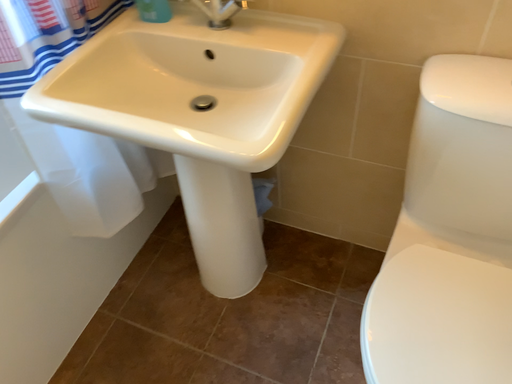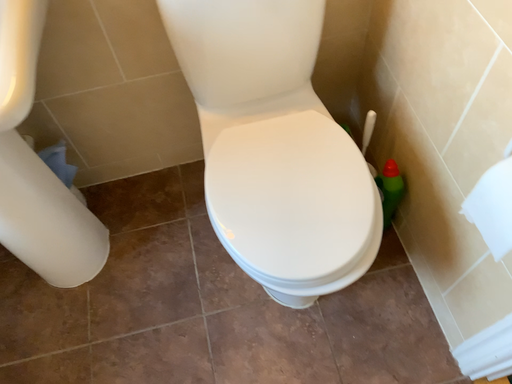
Question: Which way did the camera rotate in the video?

Choices:
 (A) rotated left
 (B) rotated right

Answer: (B)